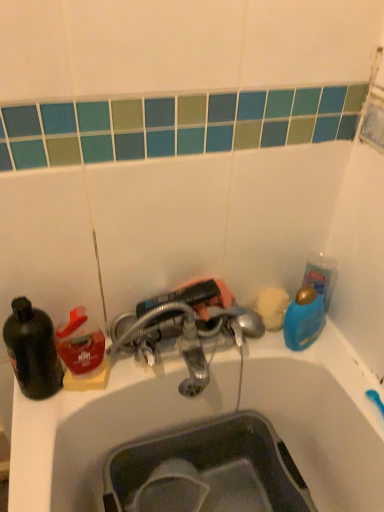
Question: Can you confirm if matte gray sink at lower center is thinner than blue glossy bottle at upper right?

Choices:
 (A) yes
 (B) no

Answer: (B)

Question: Are matte gray sink at lower center and blue glossy bottle at upper right beside each other?

Choices:
 (A) no
 (B) yes

Answer: (A)

Question: From the image's perspective, is matte gray sink at lower center located beneath blue glossy bottle at upper right?

Choices:
 (A) no
 (B) yes

Answer: (B)

Question: Is matte gray sink at lower center positioned far away from blue glossy bottle at upper right?

Choices:
 (A) yes
 (B) no

Answer: (B)

Question: From the image's perspective, would you say matte gray sink at lower center is positioned over blue glossy bottle at upper right?

Choices:
 (A) yes
 (B) no

Answer: (B)

Question: Would you say black matte bottle at left is to the left or to the right of translucent plastic bottle at left in the picture?

Choices:
 (A) left
 (B) right

Answer: (A)

Question: Considering their positions, is black matte bottle at left located in front of or behind translucent plastic bottle at left?

Choices:
 (A) front
 (B) behind

Answer: (A)

Question: From the image's perspective, is black matte bottle at left positioned above or below translucent plastic bottle at left?

Choices:
 (A) above
 (B) below

Answer: (B)

Question: Is black matte bottle at left spatially inside translucent plastic bottle at left, or outside of it?

Choices:
 (A) outside
 (B) inside

Answer: (A)

Question: In terms of size, does blue glossy bottle at upper right appear bigger or smaller than matte gray sink at lower center?

Choices:
 (A) small
 (B) big

Answer: (A)

Question: In the image, is blue glossy bottle at upper right positioned in front of or behind matte gray sink at lower center?

Choices:
 (A) front
 (B) behind

Answer: (B)

Question: Is blue glossy bottle at upper right to the left or to the right of matte gray sink at lower center in the image?

Choices:
 (A) left
 (B) right

Answer: (B)

Question: Considering the positions of point (307, 332) and point (269, 466), is point (307, 332) closer or farther from the camera than point (269, 466)?

Choices:
 (A) farther
 (B) closer

Answer: (A)

Question: Is translucent plastic bottle at left bigger or smaller than matte gray sink at lower center?

Choices:
 (A) small
 (B) big

Answer: (A)

Question: From the image's perspective, relative to matte gray sink at lower center, is translucent plastic bottle at left above or below?

Choices:
 (A) below
 (B) above

Answer: (B)